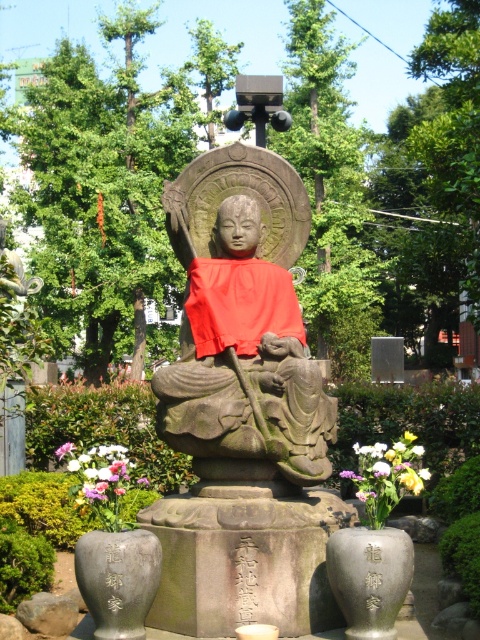
Is matte stone statue at center smaller than pink fabric flower at center?

Indeed, matte stone statue at center has a smaller size compared to pink fabric flower at center.

Does matte stone statue at center have a larger size compared to pink fabric flower at center?

No, matte stone statue at center is not bigger than pink fabric flower at center.

At what (x,y) coordinates should I click in order to perform the action: click on matte stone statue at center. Please return your answer as a coordinate pair (x, y). The image size is (480, 640). Looking at the image, I should click on (239, 193).

Between matte stone statue at center and pink fabric flowers at lower left, which one has less height?

pink fabric flowers at lower left

You are a GUI agent. You are given a task and a screenshot of the screen. Output one action in this format:
    pyautogui.click(x=<x>, y=<y>)
    Task: Click on the matte stone statue at center
    The width and height of the screenshot is (480, 640).
    Given the screenshot: What is the action you would take?
    pyautogui.click(x=239, y=193)

Between pink fabric flowers at lower left and pink fabric flower at center, which one is positioned lower?

pink fabric flower at center

Between pink fabric flowers at lower left and pink fabric flower at center, which one is positioned higher?

pink fabric flowers at lower left

Between point (103, 460) and point (60, 458), which one is positioned in front?

Point (103, 460)

In order to click on pink fabric flowers at lower left in this screenshot , I will do `click(99, 472)`.